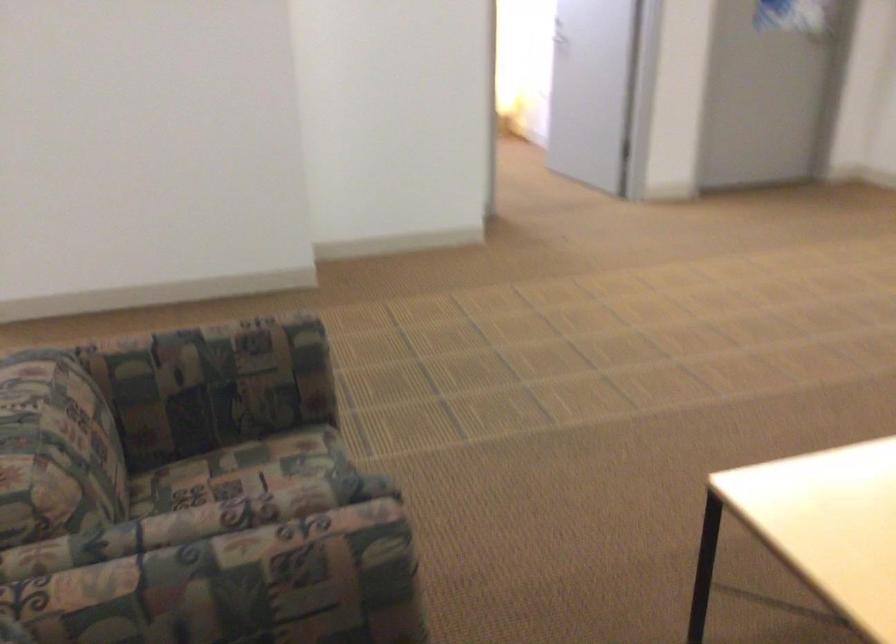
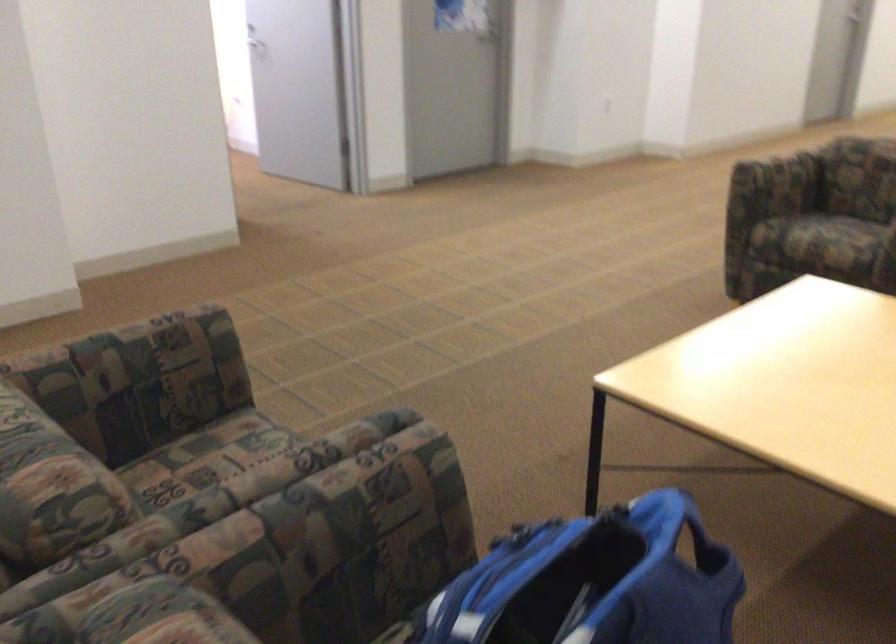
Question: The images are taken continuously from a first-person perspective. In which direction is your viewpoint rotating?

Choices:
 (A) Left
 (B) Right
 (C) Up
 (D) Down

Answer: (B)